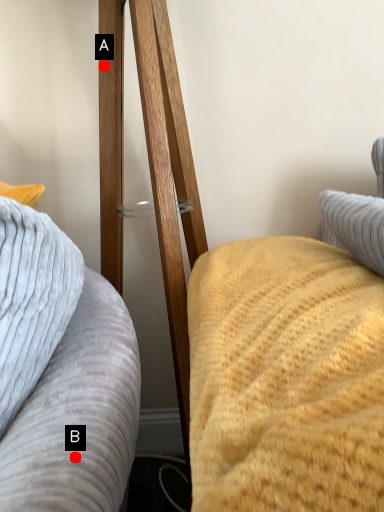
Question: Two points are circled on the image, labeled by A and B beside each circle. Which point is closer to the camera taking this photo?

Choices:
 (A) A is closer
 (B) B is closer

Answer: (B)